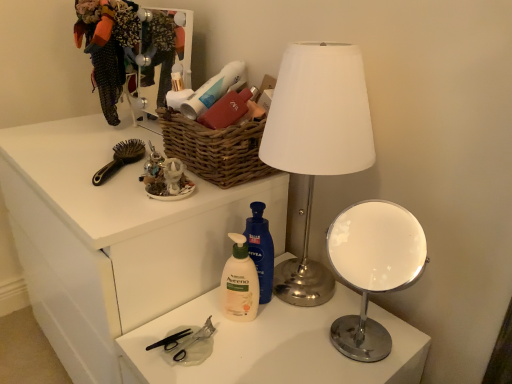
Identify the location of vacant area that lies between metallic silver lamp at center and black plastic scissors at lower center. The image size is (512, 384). coord(251,339).